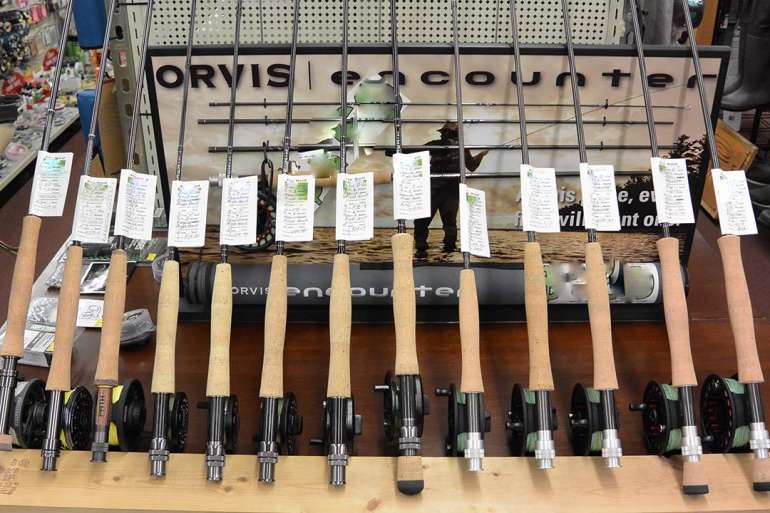
The width and height of the screenshot is (770, 513). I want to click on reddish brown wood, so click(570, 365).